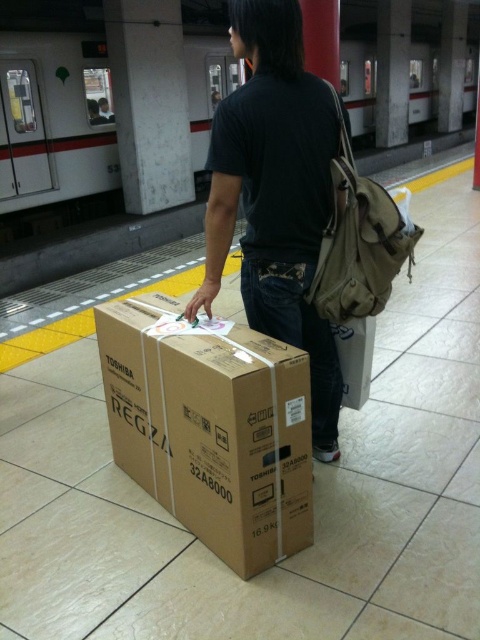
Question: Can you confirm if black cotton shirt at center is positioned above khaki canvas backpack at right?

Choices:
 (A) yes
 (B) no

Answer: (B)

Question: Among these points, which one is farthest from the camera?

Choices:
 (A) (339, 100)
 (B) (284, 419)
 (C) (279, 266)

Answer: (C)

Question: Can you confirm if black cotton shirt at center is bigger than khaki canvas backpack at right?

Choices:
 (A) no
 (B) yes

Answer: (B)

Question: Can you confirm if brown cardboard box at center is smaller than black cotton shirt at center?

Choices:
 (A) yes
 (B) no

Answer: (B)

Question: Which of the following is the closest to the observer?

Choices:
 (A) (289, 138)
 (B) (289, 550)
 (C) (359, 289)

Answer: (A)

Question: Estimate the real-world distances between objects in this image. Which object is closer to the khaki canvas backpack at right?

Choices:
 (A) brown cardboard box at center
 (B) black cotton shirt at center

Answer: (B)